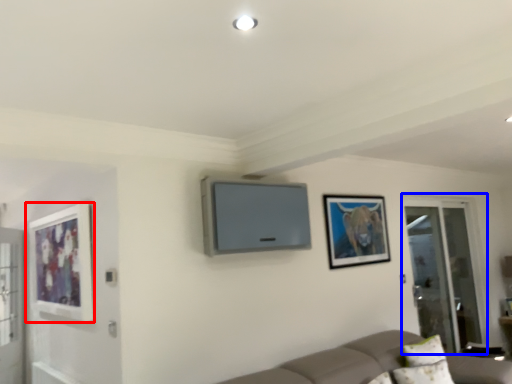
Question: Which point is closer to the camera, picture frame (highlighted by a red box) or screen door (highlighted by a blue box)?

Choices:
 (A) picture frame
 (B) screen door

Answer: (A)